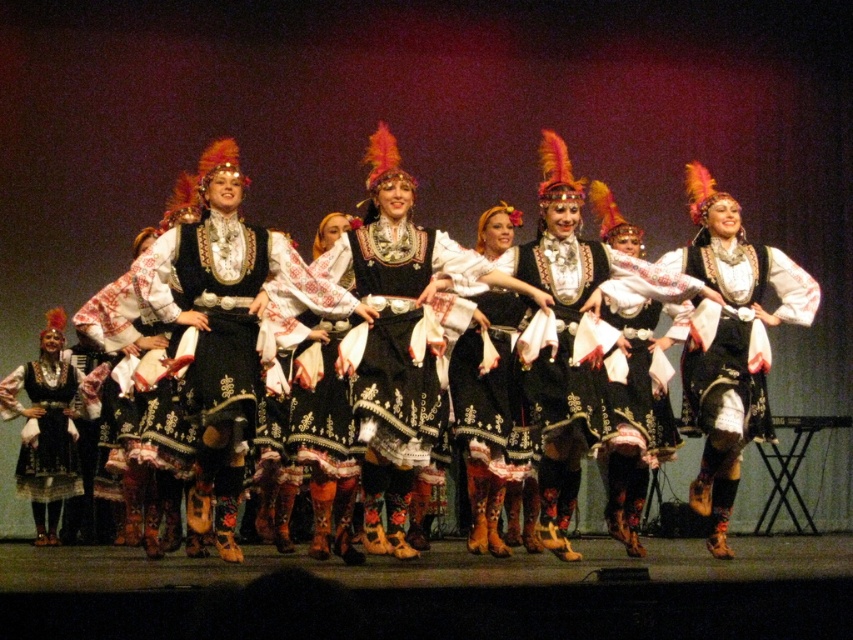
You are a photographer positioned at the front of the stage. You want to take a photo focusing on the embroidered velvet dress at center without the black embroidered dress at center blocking it. Is this possible given their positions?

The black embroidered dress at center is closer to the viewer than the embroidered velvet dress at center, so it will block the view of the embroidered velvet dress at center. Therefore, it is not possible to take a photo focusing on the embroidered velvet dress at center without the black embroidered dress at center blocking it.

You are a photographer positioned at the back of the stage. You want to capture a photo that includes both the black embroidered dress at center and the embroidered velvet dress at center. Which dress should you focus on first to ensure both are in the frame?

The black embroidered dress at center is located above the embroidered velvet dress at center, so you should focus on the embroidered velvet dress at center first to ensure both are in the frame.

You are a photographer positioned at the back of the stage. You need to take a photo of both the embroidered velvet dress at center and the black satin dress at center. Since you can only focus on one dress at a time, which one should you focus on first to ensure the other is still in frame?

You should focus on the black satin dress at center first because it is to the left of the embroidered velvet dress at center, so by focusing on the leftmost dress first, the embroidered velvet dress at center will remain in the frame when you adjust your camera.